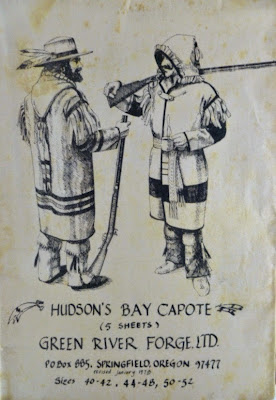
Find the location of a particular element. hood is located at coordinates (184, 49).